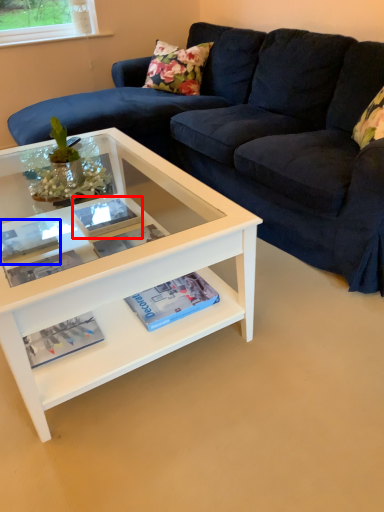
Question: Among these objects, which one is nearest to the camera, paperback book (highlighted by a red box) or book (highlighted by a blue box)?

Choices:
 (A) paperback book
 (B) book

Answer: (B)